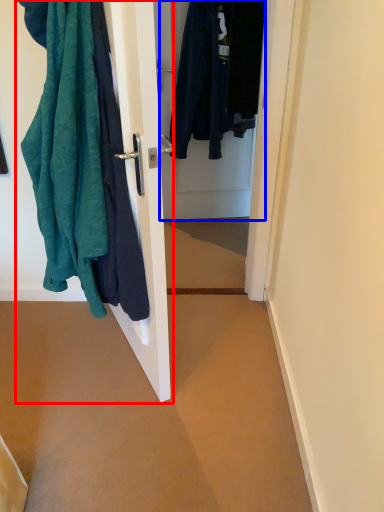
Question: Which object is further to the camera taking this photo, closet (highlighted by a red box) or door (highlighted by a blue box)?

Choices:
 (A) closet
 (B) door

Answer: (B)